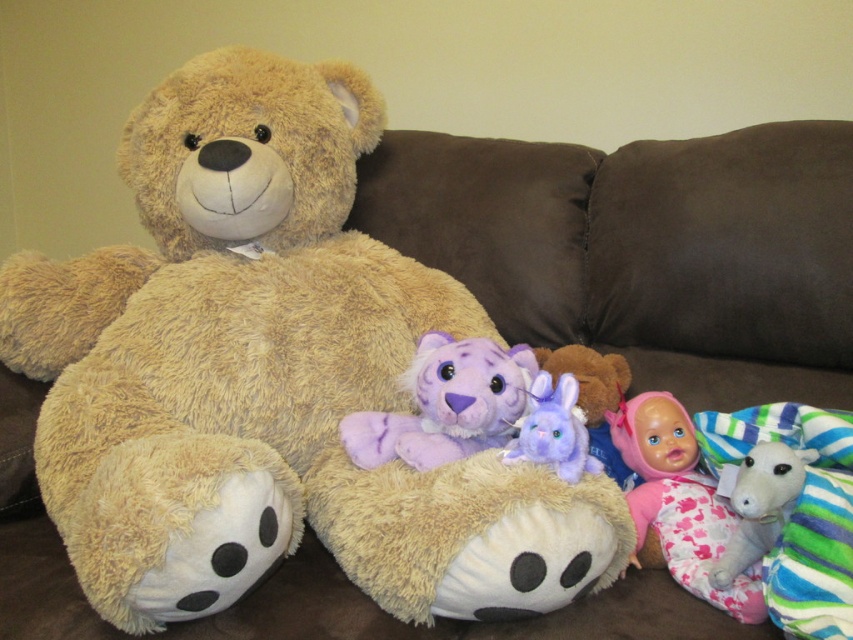
Is pink fabric doll at lower right to the right of purple plush rabbit at center from the viewer's perspective?

Indeed, pink fabric doll at lower right is positioned on the right side of purple plush rabbit at center.

Is pink fabric doll at lower right in front of purple plush rabbit at center?

That is True.

The width and height of the screenshot is (853, 640). What do you see at coordinates (679, 500) in the screenshot?
I see `pink fabric doll at lower right` at bounding box center [679, 500].

This screenshot has height=640, width=853. I want to click on pink fabric doll at lower right, so click(x=679, y=500).

Does purple plush tiger at center have a greater width compared to purple plush rabbit at center?

Yes.

Does purple plush tiger at center have a larger size compared to purple plush rabbit at center?

Indeed, purple plush tiger at center has a larger size compared to purple plush rabbit at center.

Which is behind, point (496, 429) or point (526, 448)?

The point (496, 429) is behind.

The image size is (853, 640). Find the location of `purple plush tiger at center`. purple plush tiger at center is located at coordinates (445, 404).

Between white plush goat at lower right and purple plush rabbit at center, which one has less height?

purple plush rabbit at center

Does white plush goat at lower right have a lesser width compared to purple plush rabbit at center?

Yes, white plush goat at lower right is thinner than purple plush rabbit at center.

Is point (757, 488) closer to camera compared to point (537, 416)?

Yes, it is.

Locate an element on the screen. The height and width of the screenshot is (640, 853). white plush goat at lower right is located at coordinates (759, 506).